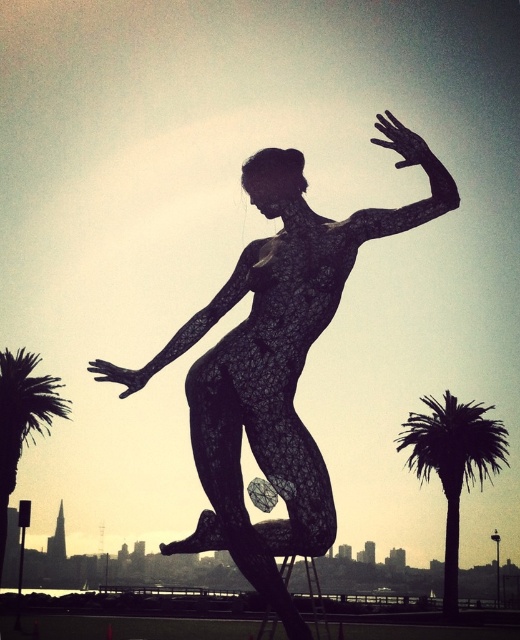
Question: Estimate the real-world distances between objects in this image. Which object is closer to the green leafy palm tree at left?

Choices:
 (A) green leafy palm tree at right
 (B) black wireframe figure at center

Answer: (A)

Question: Does green leafy palm tree at right appear over green leafy palm tree at left?

Choices:
 (A) no
 (B) yes

Answer: (A)

Question: Which of the following is the farthest from the observer?

Choices:
 (A) green leafy palm tree at right
 (B) green leafy palm tree at left
 (C) black wireframe figure at center

Answer: (A)

Question: Can you confirm if black wireframe figure at center is smaller than green leafy palm tree at left?

Choices:
 (A) no
 (B) yes

Answer: (B)

Question: Based on their relative distances, which object is farther from the green leafy palm tree at right?

Choices:
 (A) black wireframe figure at center
 (B) green leafy palm tree at left

Answer: (A)

Question: Does green leafy palm tree at right appear on the right side of green leafy palm tree at left?

Choices:
 (A) yes
 (B) no

Answer: (A)